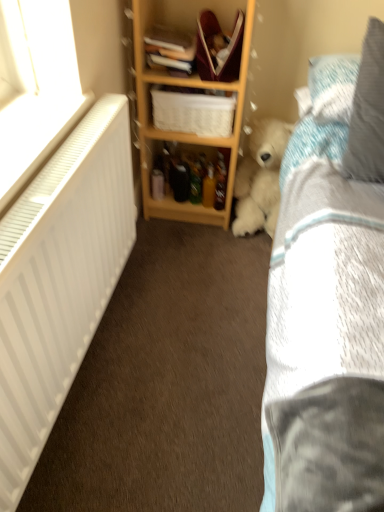
Question: Is hardcover book at upper center, marked as the second book in a top-to-bottom arrangement, inside the boundaries of white plastic radiator at left, or outside?

Choices:
 (A) inside
 (B) outside

Answer: (B)

Question: In terms of height, does hardcover book at upper center, the 1th book from the bottom, look taller or shorter compared to white plastic radiator at left?

Choices:
 (A) short
 (B) tall

Answer: (A)

Question: Estimate the real-world distances between objects in this image. Which object is closer to the hardcover book at upper center, which ranks as the second book in bottom-to-top order?

Choices:
 (A) wooden shelf at center
 (B) fluffy white teddy bear at lower right
 (C) white plastic radiator at left
 (D) blue textured pillow at upper right, which ranks as the first pillow in back-to-front order
 (E) white woven basket at center

Answer: (E)

Question: Which object is positioned farthest from the wooden shelf at center?

Choices:
 (A) hardcover book at upper center, marked as the second book in a top-to-bottom arrangement
 (B) gray fabric pillow at upper right, arranged as the 1th pillow when viewed from the front
 (C) white woven basket at center
 (D) fluffy white teddy bear at lower right
 (E) blue textured pillow at upper right, positioned as the 2th pillow in front-to-back order

Answer: (B)